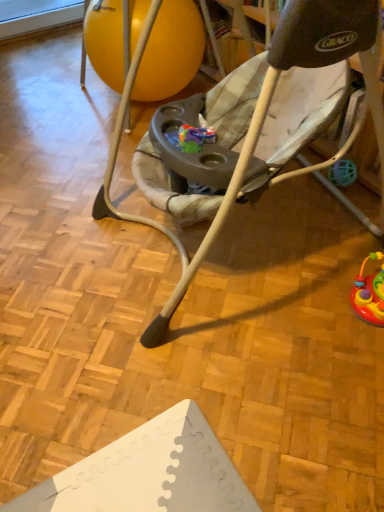
This screenshot has width=384, height=512. Find the location of `vacant space in gray fabric baby swing at center (from a real-world perspective)`. vacant space in gray fabric baby swing at center (from a real-world perspective) is located at coordinates (250, 241).